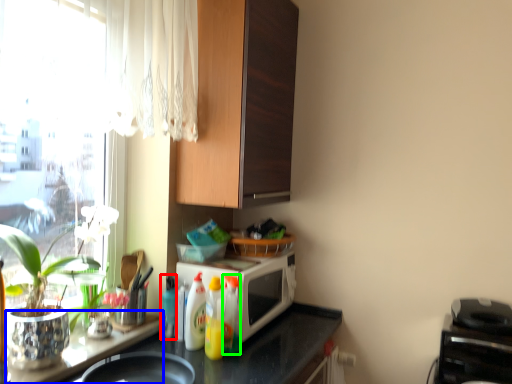
Question: Which object is positioned closest to bottle (highlighted by a red box)? Select from table (highlighted by a blue box) and bottle (highlighted by a green box).

Choices:
 (A) table
 (B) bottle

Answer: (A)